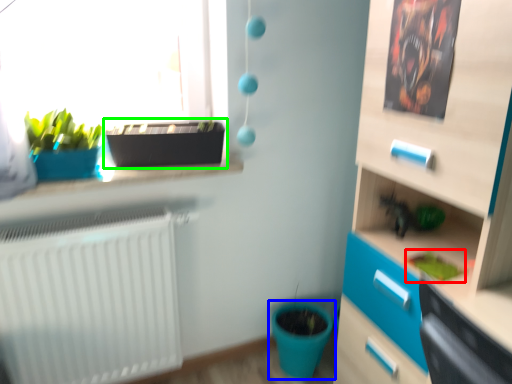
Question: Which object is the farthest from plant (highlighted by a red box)? Choose among these: flowerpot (highlighted by a blue box) or flowerpot (highlighted by a green box).

Choices:
 (A) flowerpot
 (B) flowerpot

Answer: (B)